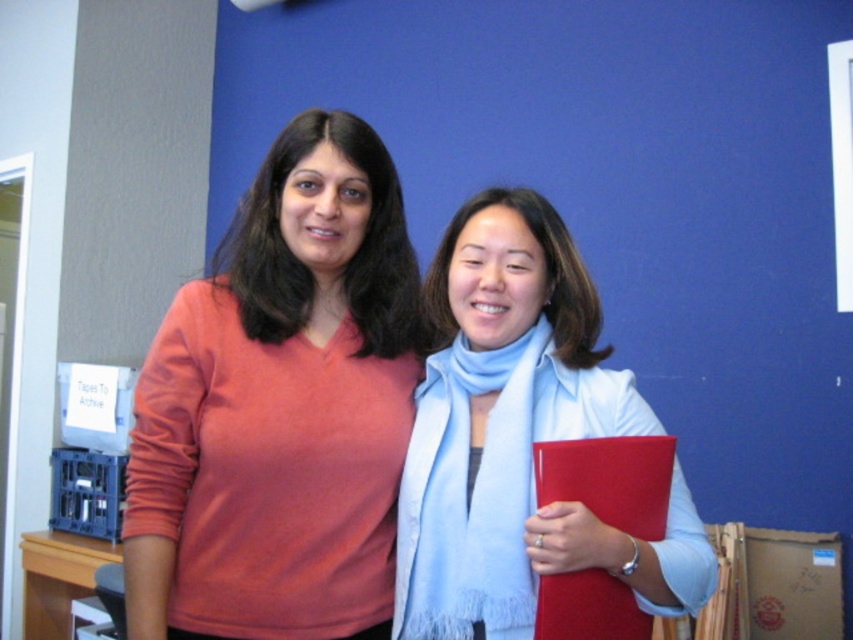
You are trying to decide which light blue scarf to wear for a casual day out. Both the light blue scarf at center and the light blue soft scarf at center are options. Based on their sizes, which one would be better for a more voluminous look?

The light blue scarf at center is wider than the light blue soft scarf at center, so it would provide a more voluminous look for your casual day out.

You are trying to determine which scarf is visible on top. Which one is the light blue scarf at center or the light blue soft scarf at center?

The light blue scarf at center is positioned over the light blue soft scarf at center, so the light blue scarf at center is the one visible on top.

You are an interior designer assessing the color coordination in the office scene. The matte orange sweater at center and the light blue scarf at center are part of the decor. Which color is placed higher up in the scene?

The matte orange sweater at center is above the light blue scarf at center, so the orange color is placed higher up in the scene.